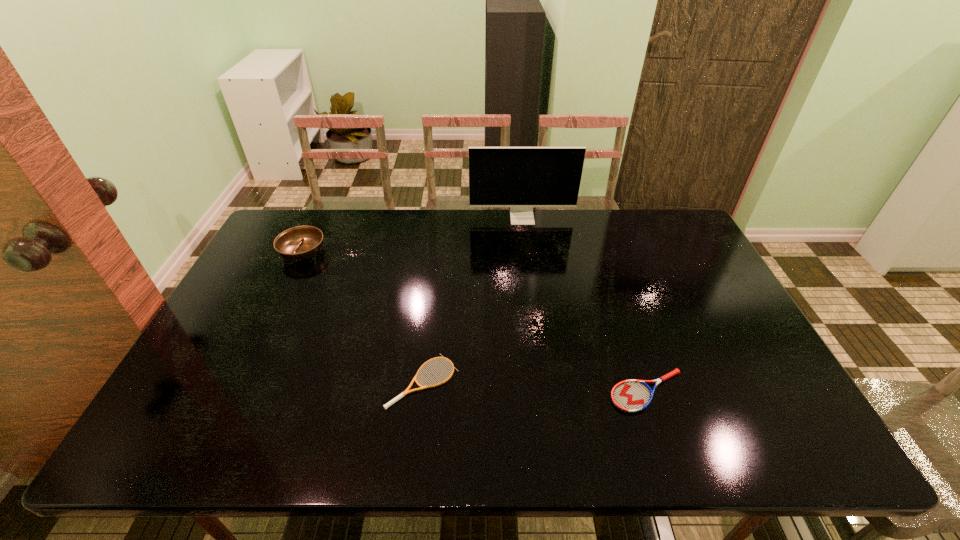
Find the location of a particular element. This screenshot has height=540, width=960. free space between the third shortest object and the monitor is located at coordinates (413, 235).

This screenshot has width=960, height=540. Find the location of `free space between the right tennis racket and the third shortest object`. free space between the right tennis racket and the third shortest object is located at coordinates (475, 322).

Image resolution: width=960 pixels, height=540 pixels. What are the coordinates of `empty space between the monitor and the left tennis racket` in the screenshot? It's located at (472, 300).

This screenshot has height=540, width=960. Identify the location of free area in between the soup bowl and the farthest object. (413, 235).

You are a GUI agent. You are given a task and a screenshot of the screen. Output one action in this format:
    pyautogui.click(x=<x>, y=<y>)
    Task: Click on the free space between the right tennis racket and the left tennis racket
    This screenshot has width=960, height=540.
    Given the screenshot: What is the action you would take?
    pyautogui.click(x=536, y=386)

Find the location of `vacant space that is in between the second tallest object and the right tennis racket`. vacant space that is in between the second tallest object and the right tennis racket is located at coordinates (475, 322).

Where is `free spot between the left tennis racket and the farthest object`? The image size is (960, 540). free spot between the left tennis racket and the farthest object is located at coordinates (472, 300).

Locate an element on the screen. Image resolution: width=960 pixels, height=540 pixels. free area in between the right tennis racket and the soup bowl is located at coordinates (475, 322).

Image resolution: width=960 pixels, height=540 pixels. Find the location of `vacant point located between the leftmost object and the second object from left to right`. vacant point located between the leftmost object and the second object from left to right is located at coordinates (363, 316).

Where is `vacant area that lies between the second tallest object and the right tennis racket`? The image size is (960, 540). vacant area that lies between the second tallest object and the right tennis racket is located at coordinates (475, 322).